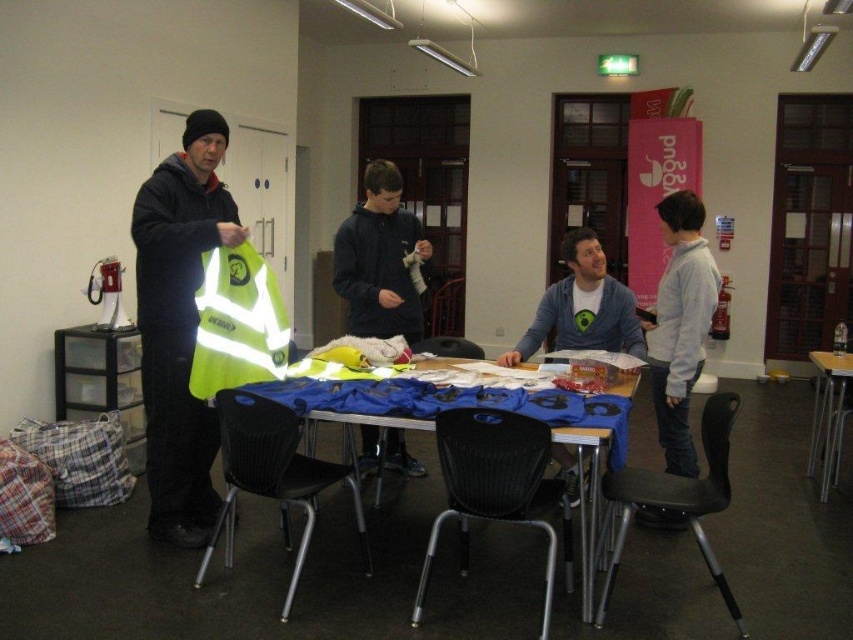
Question: Can you confirm if blue fabric table at center is positioned above dark blue hoodie at center?

Choices:
 (A) yes
 (B) no

Answer: (B)

Question: Among these objects, which one is nearest to the camera?

Choices:
 (A) high-visibility fabric safety vest at center
 (B) reflective fabric high visibility vest at left
 (C) blue fabric table at center
 (D) dark blue hoodie at center

Answer: (C)

Question: Does reflective fabric high visibility vest at left appear over blue fabric table at center?

Choices:
 (A) no
 (B) yes

Answer: (B)

Question: Where is reflective fabric high visibility vest at left located in relation to dark blue hoodie at center in the image?

Choices:
 (A) right
 (B) left

Answer: (B)

Question: Which object is the farthest from the black plastic chair at lower center?

Choices:
 (A) reflective fabric high visibility vest at left
 (B) high-visibility fabric safety vest at center
 (C) wooden table at right
 (D) dark blue hoodie at center

Answer: (C)

Question: Which object is closer to the camera taking this photo?

Choices:
 (A) blue fabric table at center
 (B) wooden table at right

Answer: (A)